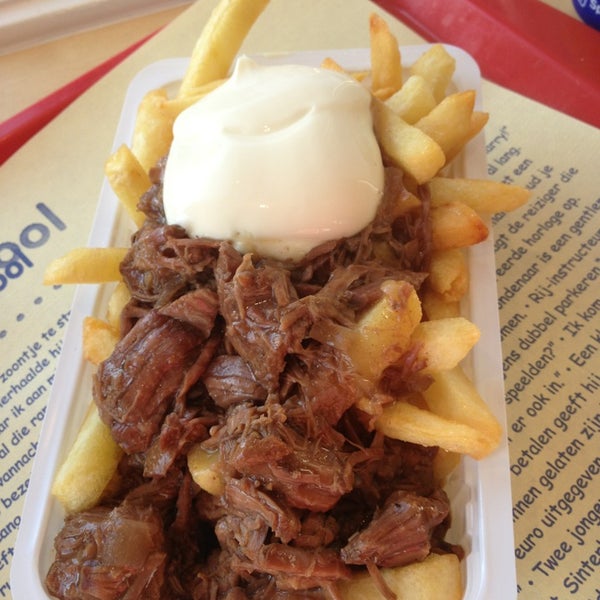
You are a GUI agent. You are given a task and a screenshot of the screen. Output one action in this format:
    pyautogui.click(x=<x>, y=<y>)
    Task: Click on the red tray
    This screenshot has height=600, width=600.
    Given the screenshot: What is the action you would take?
    pyautogui.click(x=555, y=62)